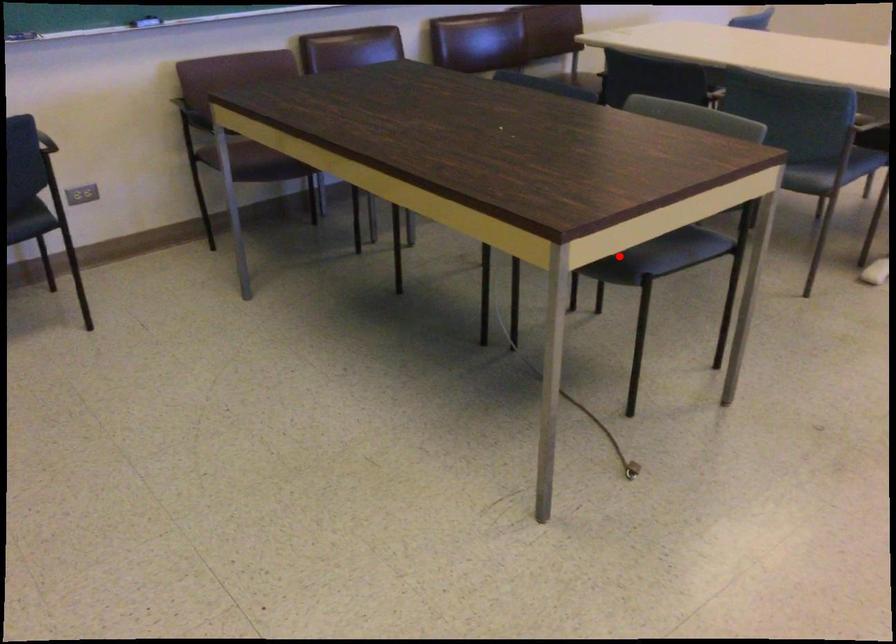
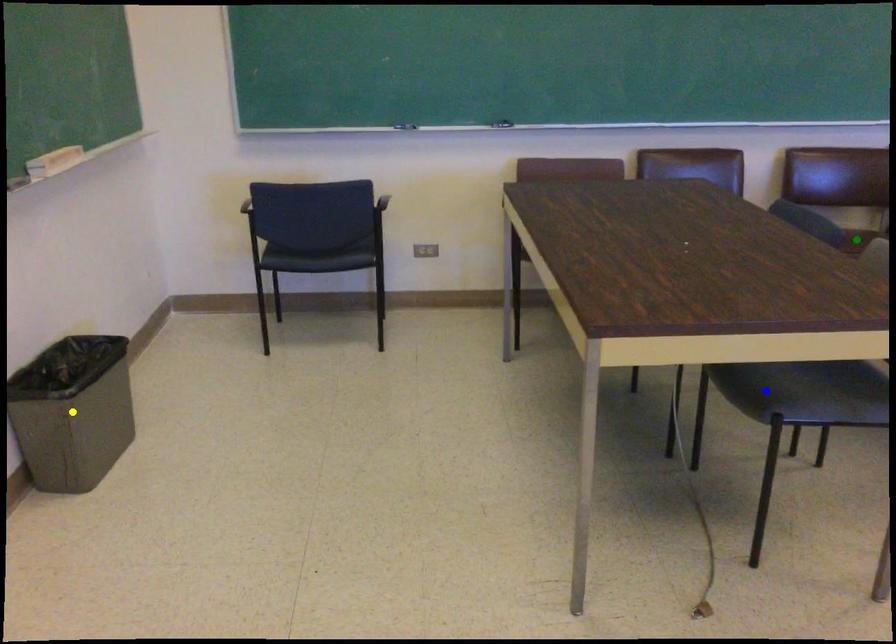
Question: I am providing you with two images of the same scene from different viewpoints. A red point is marked on the first image. You are given multiple points on the second image. Can you choose the point in image 2 that corresponds to the point in image 1?

Choices:
 (A) yellow point
 (B) green point
 (C) blue point

Answer: (C)